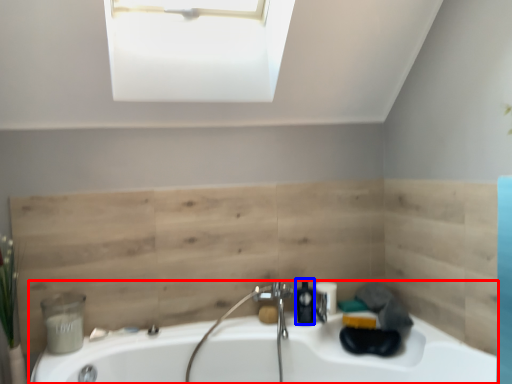
Question: Among these objects, which one is farthest to the camera, bathtub (highlighted by a red box) or soap dispenser (highlighted by a blue box)?

Choices:
 (A) bathtub
 (B) soap dispenser

Answer: (B)